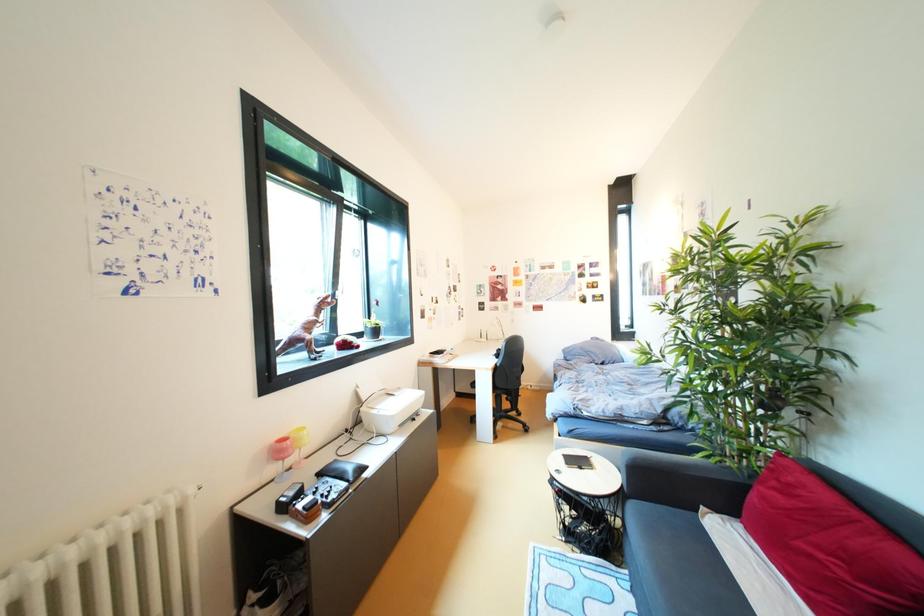
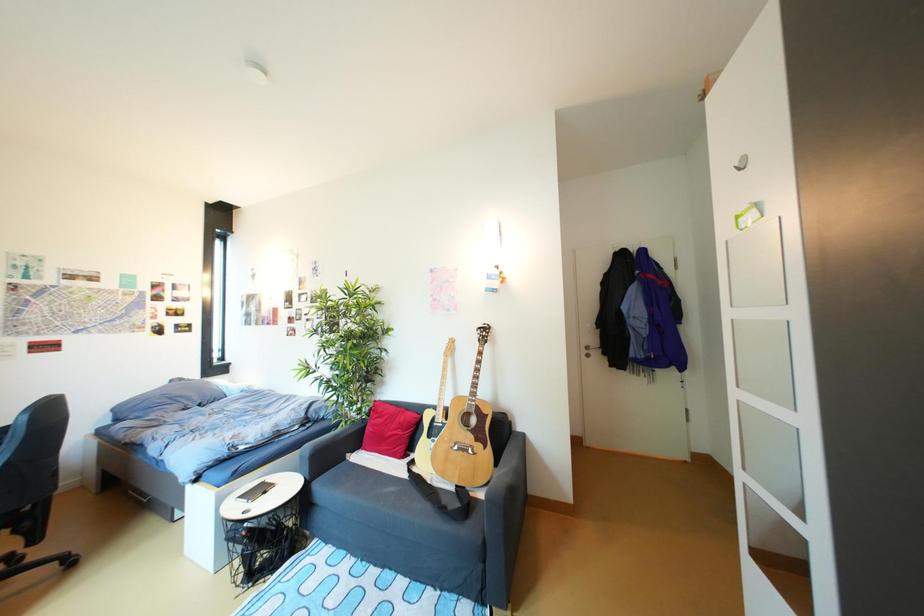
Question: The camera is either moving clockwise (left) or counter-clockwise (right) around the object. The first image is from the beginning of the video and the second image is from the end. Is the camera moving left or right when shooting the video?

Choices:
 (A) Left
 (B) Right

Answer: (A)